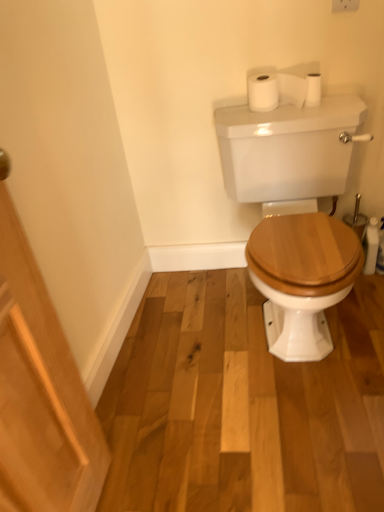
Identify the location of free space in front of white matte toilet paper at upper center, which is the 1th toilet paper from left to right. (284, 116).